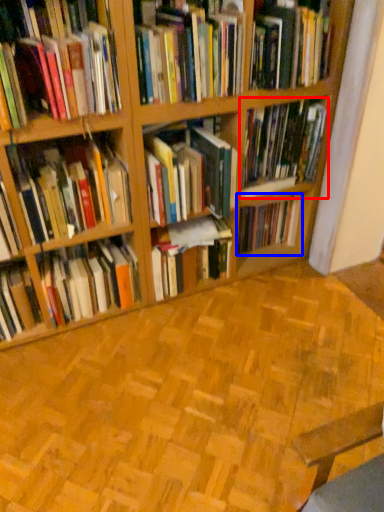
Question: Among these objects, which one is nearest to the camera, book (highlighted by a red box) or book (highlighted by a blue box)?

Choices:
 (A) book
 (B) book

Answer: (A)